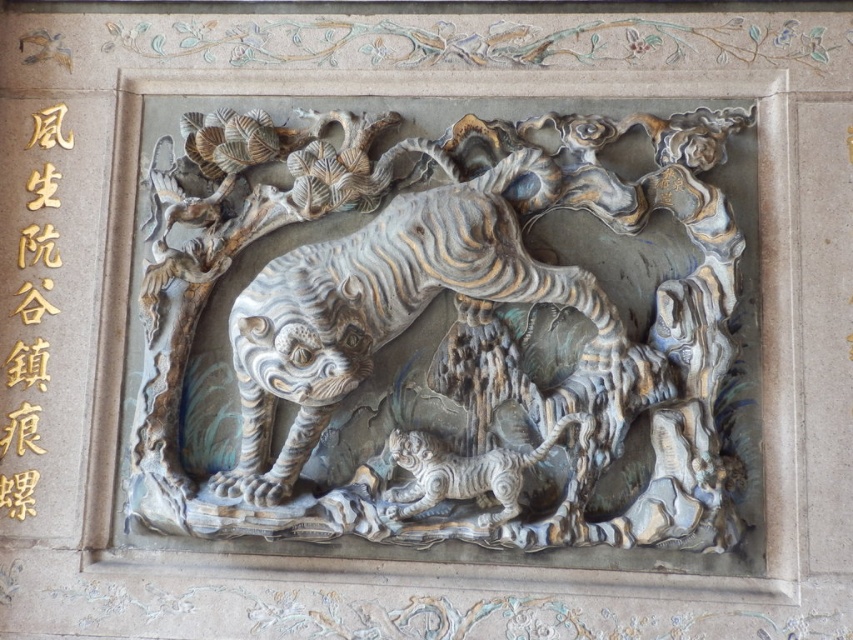
You are an art conservator examining the stone relief sculpture. You need to place a protective barrier between the gray stone tiger at center and the white marble tiger at center. Based on their positions, which tiger should the barrier be closer to?

The gray stone tiger at center is positioned on the left side of the white marble tiger at center, so the barrier should be placed closer to the white marble tiger at center to separate them effectively.

You are an art conservator examining the stone relief sculpture. You need to place both the gray stone tiger at center and the white marble tiger at center onto a display stand that can only accommodate a maximum width of 1.2 meters. Given their sizes, can both tigers fit side by side on the stand without overlapping?

The gray stone tiger at center is wider than the white marble tiger at center. Since the display stand has a maximum width of 1.2 meters, we need to know the exact widths of both tigers to determine if their combined width is within the limit. However, the provided information only states that the gray stone tiger is larger in width, not the specific measurements. Without the exact dimensions, it is impossible to confirm if they can fit together on the stand.